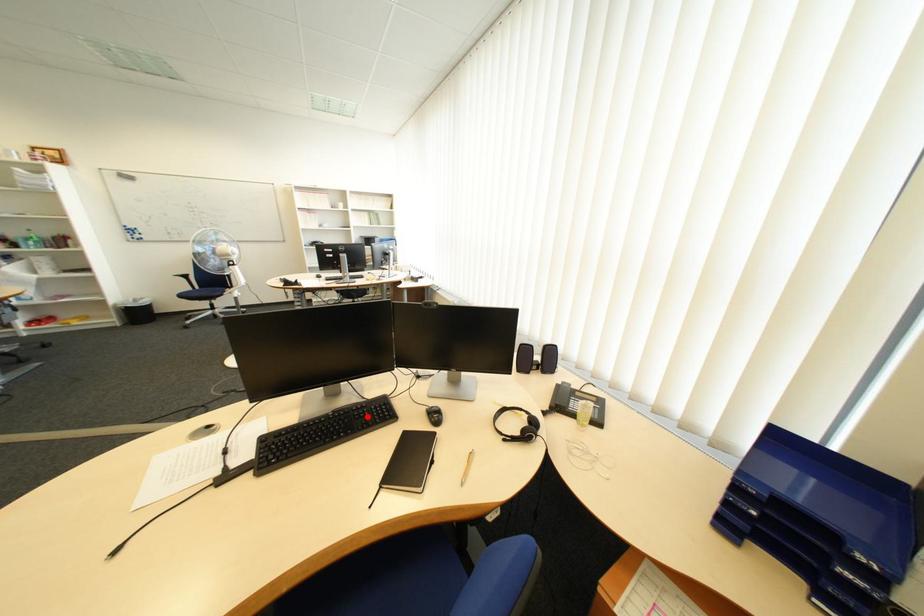
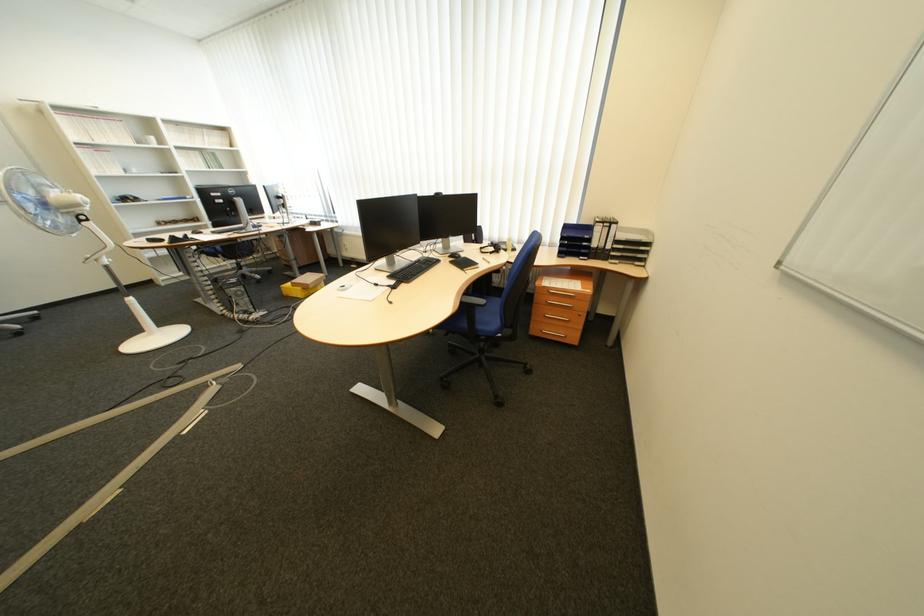
The point at the highlighted location is marked in the first image. Where is the corresponding point in the second image?

(433, 264)